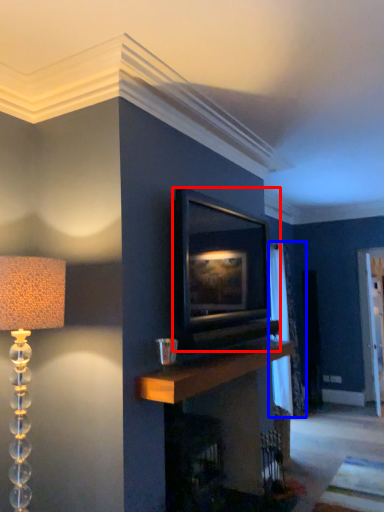
Question: Which object is closer to the camera taking this photo, picture frame (highlighted by a red box) or curtain (highlighted by a blue box)?

Choices:
 (A) picture frame
 (B) curtain

Answer: (A)